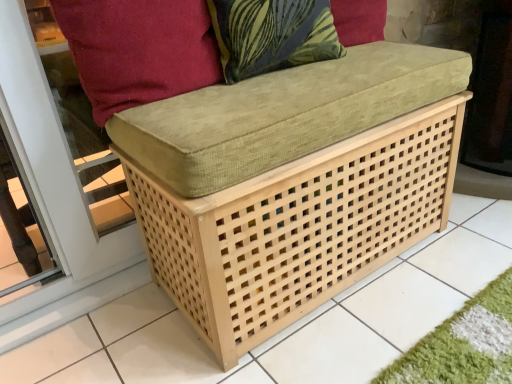
This screenshot has width=512, height=384. I want to click on velvety green pillow at upper center, so click(x=272, y=35).

Describe the element at coordinates (272, 35) in the screenshot. The height and width of the screenshot is (384, 512). I see `velvety green pillow at upper center` at that location.

What do you see at coordinates (138, 50) in the screenshot?
I see `suede-like red cushion at upper left` at bounding box center [138, 50].

This screenshot has height=384, width=512. What are the coordinates of `suede-like red cushion at upper left` in the screenshot? It's located at (138, 50).

Measure the distance between point (114, 27) and camera.

Point (114, 27) is 38.66 inches away from camera.

Locate an element on the screen. Image resolution: width=512 pixels, height=384 pixels. velvety green pillow at upper center is located at coordinates (272, 35).

Considering the positions of objects velvety green pillow at upper center and suede-like red cushion at upper left in the image provided, who is more to the right, velvety green pillow at upper center or suede-like red cushion at upper left?

From the viewer's perspective, velvety green pillow at upper center appears more on the right side.

Which object is further away from the camera, velvety green pillow at upper center or suede-like red cushion at upper left?

Positioned behind is velvety green pillow at upper center.

Which is further, (256,20) or (115,11)?

Positioned behind is point (256,20).

From the image's perspective, between velvety green pillow at upper center and suede-like red cushion at upper left, who is located below?

suede-like red cushion at upper left appears lower in the image.

From a real-world perspective, which object rests below the other?

In real-world perspective, suede-like red cushion at upper left is lower.

Which of these two, velvety green pillow at upper center or suede-like red cushion at upper left, is wider?

Wider between the two is velvety green pillow at upper center.

Considering the sizes of objects velvety green pillow at upper center and suede-like red cushion at upper left in the image provided, who is taller, velvety green pillow at upper center or suede-like red cushion at upper left?

suede-like red cushion at upper left is taller.

Considering the sizes of objects velvety green pillow at upper center and suede-like red cushion at upper left in the image provided, who is bigger, velvety green pillow at upper center or suede-like red cushion at upper left?

suede-like red cushion at upper left.

Is velvety green pillow at upper center inside the boundaries of suede-like red cushion at upper left, or outside?

velvety green pillow at upper center is not enclosed by suede-like red cushion at upper left.

Would you consider velvety green pillow at upper center to be distant from suede-like red cushion at upper left?

No, velvety green pillow at upper center is not far away from suede-like red cushion at upper left.

From the picture: Is velvety green pillow at upper center oriented away from suede-like red cushion at upper left?

That's not correct — velvety green pillow at upper center is not looking away from suede-like red cushion at upper left.

What's the angular difference between velvety green pillow at upper center and suede-like red cushion at upper left's facing directions?

The angular difference between velvety green pillow at upper center and suede-like red cushion at upper left is 0.000789 degrees.

Where is `pillow located in front of the velvety green pillow at upper center`? The height and width of the screenshot is (384, 512). pillow located in front of the velvety green pillow at upper center is located at coordinates (138, 50).

Is suede-like red cushion at upper left to the left of velvety green pillow at upper center from the viewer's perspective?

Correct, you'll find suede-like red cushion at upper left to the left of velvety green pillow at upper center.

In the scene shown: Is suede-like red cushion at upper left in front of or behind velvety green pillow at upper center in the image?

In the image, suede-like red cushion at upper left appears in front of velvety green pillow at upper center.

Is point (86, 46) closer or farther from the camera than point (317, 55)?

Clearly, point (86, 46) is closer to the camera than point (317, 55).

From the image's perspective, which object appears higher, suede-like red cushion at upper left or velvety green pillow at upper center?

velvety green pillow at upper center, from the image's perspective.

From a real-world perspective, is suede-like red cushion at upper left above or below velvety green pillow at upper center?

From a real-world perspective, suede-like red cushion at upper left is physically below velvety green pillow at upper center.

Which object is wider, suede-like red cushion at upper left or velvety green pillow at upper center?

velvety green pillow at upper center.

Does suede-like red cushion at upper left have a lesser height compared to velvety green pillow at upper center?

No.

Between suede-like red cushion at upper left and velvety green pillow at upper center, which one has smaller size?

With smaller size is velvety green pillow at upper center.

Can velvety green pillow at upper center be found inside suede-like red cushion at upper left?

No, velvety green pillow at upper center is located outside of suede-like red cushion at upper left.

Is suede-like red cushion at upper left with velvety green pillow at upper center?

suede-like red cushion at upper left and velvety green pillow at upper center are clearly separated.

Could you tell me if suede-like red cushion at upper left is turned towards velvety green pillow at upper center?

No.

Based on the photo, measure the distance between suede-like red cushion at upper left and velvety green pillow at upper center.

7.51 inches.

Identify the location of pillow on the left of velvety green pillow at upper center. This screenshot has width=512, height=384. (138, 50).

This screenshot has width=512, height=384. Identify the location of throw pillow lying on the right of suede-like red cushion at upper left. (272, 35).

Find the location of a particular element. The width and height of the screenshot is (512, 384). pillow below the velvety green pillow at upper center (from a real-world perspective) is located at coordinates (138, 50).